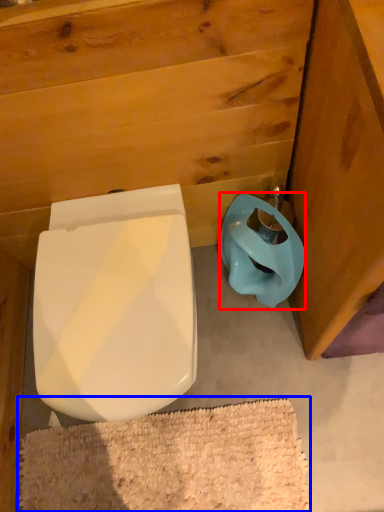
Question: Which of the following is the farthest to the observer, toilet bowl (highlighted by a red box) or bath mat (highlighted by a blue box)?

Choices:
 (A) toilet bowl
 (B) bath mat

Answer: (B)